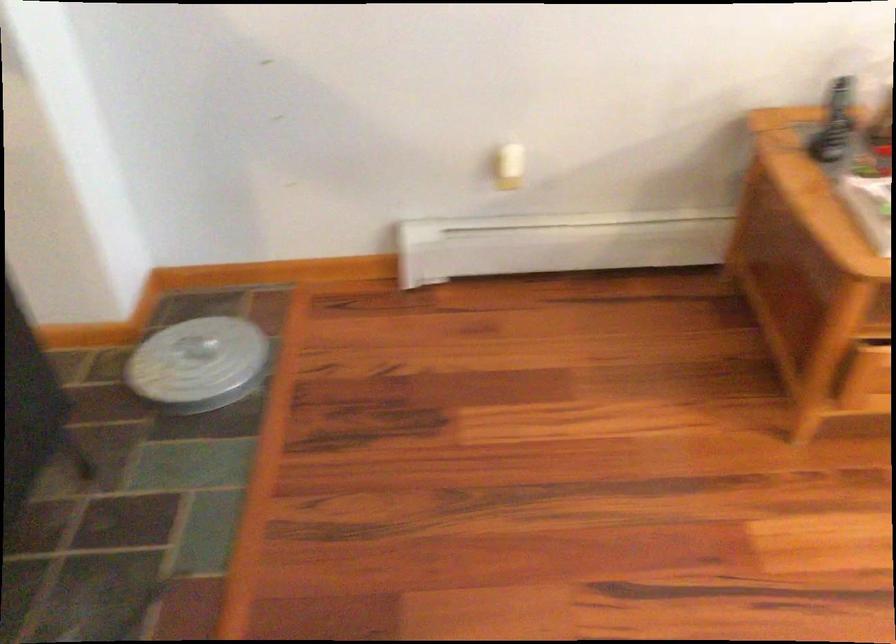
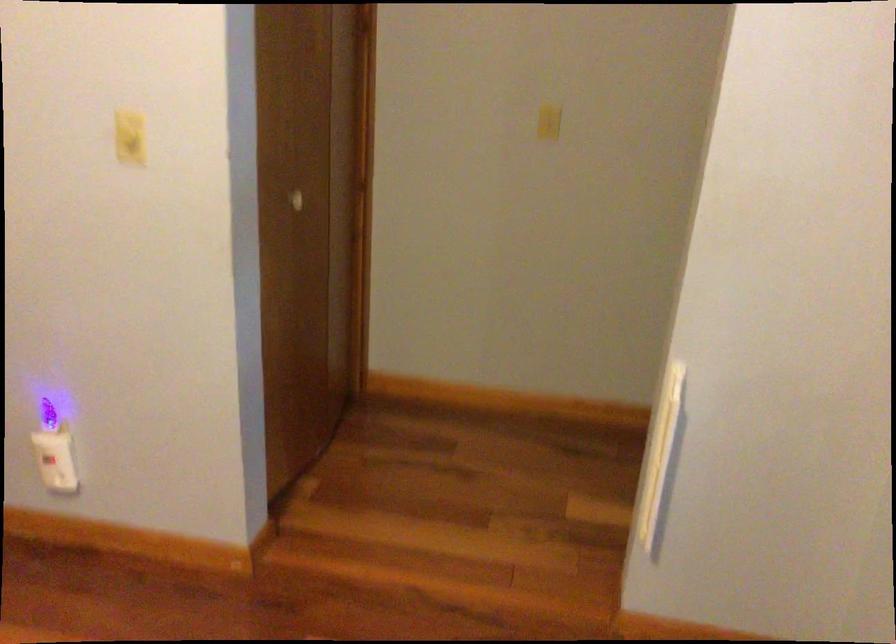
Question: The images are taken continuously from a first-person perspective. In which direction are you moving?

Choices:
 (A) Left
 (B) Right
 (C) Forward
 (D) Backward

Answer: (A)